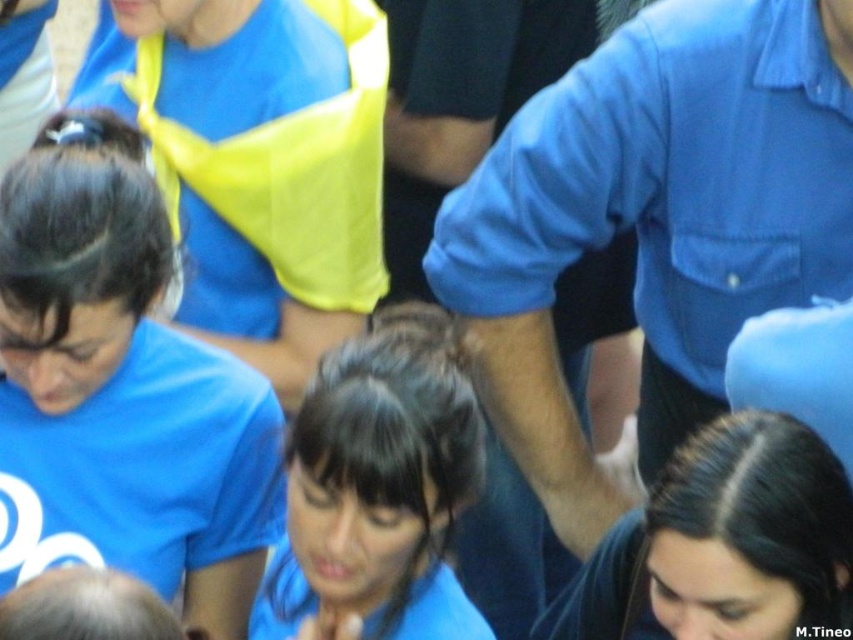
Looking at this image, you are organizing a group photo and need to arrange two blue shirts in the frame. The blue shirt at upper center and the blue matte shirt at center are both part of the team attire. Based on their positions, which shirt should be placed on the left side to ensure proper alignment with the team logo?

The blue shirt at upper center might be wider than blue matte shirt at center, so placing the wider blue shirt at upper center on the left would ensure proper alignment with the team logo.

You are a photographer trying to capture a clear shot of the dark blue hair at center and dark brown hair at center. Which one is positioned higher in the frame?

The dark blue hair at center is located above the dark brown hair at center, so it is positioned higher in the frame.